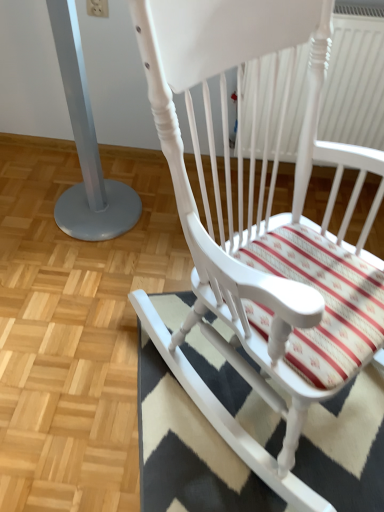
What is the approximate height of white painted wood rocking chair at center?

white painted wood rocking chair at center is 1.13 meters in height.

Locate an element on the screen. The image size is (384, 512). white painted wood rocking chair at center is located at coordinates (241, 209).

Find the location of a particular element. This screenshot has height=512, width=384. white painted wood rocking chair at center is located at coordinates (241, 209).

Where is `doormat behind the white painted wood rocking chair at center`? doormat behind the white painted wood rocking chair at center is located at coordinates (187, 449).

Considering the points (244, 347) and (246, 396), which point is behind, point (244, 347) or point (246, 396)?

The point (246, 396) is farther from the camera.

Considering the positions of objects white painted wood rocking chair at center and black-and-white striped rug at lower right in the image provided, who is behind, white painted wood rocking chair at center or black-and-white striped rug at lower right?

black-and-white striped rug at lower right is behind.

From a real-world perspective, who is located higher, white painted wood rocking chair at center or white plastic radiator at upper right?

From a 3D spatial view, white painted wood rocking chair at center is above.

How much distance is there between white painted wood rocking chair at center and white plastic radiator at upper right?

white painted wood rocking chair at center and white plastic radiator at upper right are 85.30 centimeters apart from each other.

Would you consider white painted wood rocking chair at center to be distant from white plastic radiator at upper right?

No, white painted wood rocking chair at center is not far away from white plastic radiator at upper right.

Considering the sizes of objects white painted wood rocking chair at center and white plastic radiator at upper right in the image provided, who is taller, white painted wood rocking chair at center or white plastic radiator at upper right?

Standing taller between the two is white painted wood rocking chair at center.

From the image's perspective, is white plastic radiator at upper right above or below black-and-white striped rug at lower right?

white plastic radiator at upper right is above black-and-white striped rug at lower right.

Can you tell me how much white plastic radiator at upper right and black-and-white striped rug at lower right differ in facing direction?

white plastic radiator at upper right and black-and-white striped rug at lower right are facing 16.9 degrees away from each other.

Does point (323, 135) come behind point (328, 462)?

Yes, point (323, 135) is behind point (328, 462).

In the scene shown: What's the angular difference between silver metallic pole at left and white painted wood rocking chair at center's facing directions?

They differ by 44.4 degrees in their facing directions.

From a real-world perspective, does silver metallic pole at left sit lower than white painted wood rocking chair at center?

Yes, from a real-world perspective, silver metallic pole at left is under white painted wood rocking chair at center.

Is silver metallic pole at left positioned before white painted wood rocking chair at center?

No, the depth of silver metallic pole at left is greater than that of white painted wood rocking chair at center.

Is point (337, 55) closer or farther from the camera than point (365, 222)?

Point (337, 55) appears to be closer to the viewer than point (365, 222).

Could you measure the distance between white plastic radiator at upper right and white painted wood rocking chair at center?

white plastic radiator at upper right and white painted wood rocking chair at center are 33.58 inches apart from each other.

Find the location of a particular element. The width and height of the screenshot is (384, 512). chair below the white plastic radiator at upper right (from the image's perspective) is located at coordinates (x=241, y=209).

Can you confirm if white plastic radiator at upper right is positioned to the right of white painted wood rocking chair at center?

Yes.

From a real-world perspective, who is located lower, white plastic radiator at upper right or silver metallic pole at left?

From a 3D spatial view, silver metallic pole at left is below.

In the scene shown: Is there a large distance between white plastic radiator at upper right and silver metallic pole at left?

That's not correct — white plastic radiator at upper right is a little close to silver metallic pole at left.

Does white plastic radiator at upper right turn towards silver metallic pole at left?

No, white plastic radiator at upper right is not oriented towards silver metallic pole at left.

Is silver metallic pole at left inside white plastic radiator at upper right?

That's incorrect, silver metallic pole at left is not inside white plastic radiator at upper right.

Would you say black-and-white striped rug at lower right is inside or outside white painted wood rocking chair at center?

black-and-white striped rug at lower right is spatially situated outside white painted wood rocking chair at center.

Can you confirm if black-and-white striped rug at lower right is taller than white painted wood rocking chair at center?

In fact, black-and-white striped rug at lower right may be shorter than white painted wood rocking chair at center.

Is black-and-white striped rug at lower right placed right next to white painted wood rocking chair at center?

No, black-and-white striped rug at lower right is not touching white painted wood rocking chair at center.

From a real-world perspective, which object rests below the other?

In real-world perspective, black-and-white striped rug at lower right is lower.

Image resolution: width=384 pixels, height=512 pixels. In order to click on chair located in front of the black-and-white striped rug at lower right in this screenshot , I will do `click(241, 209)`.

Locate an element on the screen. radiator beneath the white painted wood rocking chair at center (from a real-world perspective) is located at coordinates (355, 80).

Considering their positions, is silver metallic pole at left positioned further to black-and-white striped rug at lower right than white painted wood rocking chair at center?

The object further to black-and-white striped rug at lower right is silver metallic pole at left.

Consider the image. From the image, which object appears to be farther from silver metallic pole at left, black-and-white striped rug at lower right or white painted wood rocking chair at center?

→ black-and-white striped rug at lower right is positioned further to the anchor silver metallic pole at left.

Based on their spatial positions, is white painted wood rocking chair at center or white plastic radiator at upper right further from black-and-white striped rug at lower right?

white plastic radiator at upper right is positioned further to the anchor black-and-white striped rug at lower right.

Which object lies nearer to the anchor point black-and-white striped rug at lower right, white plastic radiator at upper right or silver metallic pole at left?

silver metallic pole at left.

Based on their spatial positions, is white plastic radiator at upper right or silver metallic pole at left closer to white painted wood rocking chair at center?

silver metallic pole at left.

Looking at the image, which one is located closer to white plastic radiator at upper right, black-and-white striped rug at lower right or silver metallic pole at left?

The object closer to white plastic radiator at upper right is silver metallic pole at left.

Looking at the image, which one is located further to white plastic radiator at upper right, white painted wood rocking chair at center or silver metallic pole at left?

The object further to white plastic radiator at upper right is silver metallic pole at left.

Which object lies further to the anchor point white painted wood rocking chair at center, silver metallic pole at left or white plastic radiator at upper right?

Among the two, white plastic radiator at upper right is located further to white painted wood rocking chair at center.

Locate an element on the screen. The height and width of the screenshot is (512, 384). pillar located between white painted wood rocking chair at center and black-and-white striped rug at lower right in the depth direction is located at coordinates (86, 146).

I want to click on pillar between white plastic radiator at upper right and black-and-white striped rug at lower right vertically, so click(86, 146).

This screenshot has width=384, height=512. I want to click on pillar between white painted wood rocking chair at center and white plastic radiator at upper right along the z-axis, so click(86, 146).

Find the location of a particular element. doormat between white painted wood rocking chair at center and white plastic radiator at upper right from front to back is located at coordinates (187, 449).